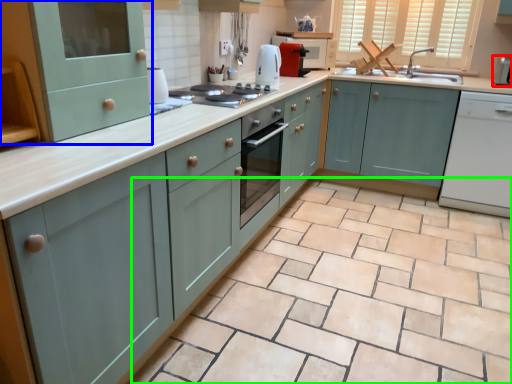
Question: Considering the real-world distances, which object is farthest from appliance (highlighted by a red box)? cabinetry (highlighted by a blue box) or ceramic tile (highlighted by a green box)?

Choices:
 (A) cabinetry
 (B) ceramic tile

Answer: (A)